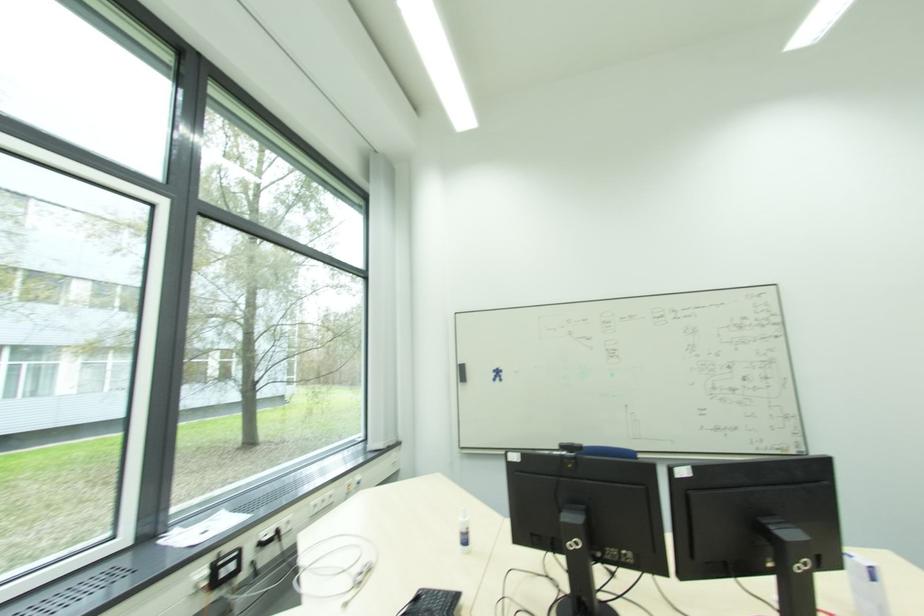
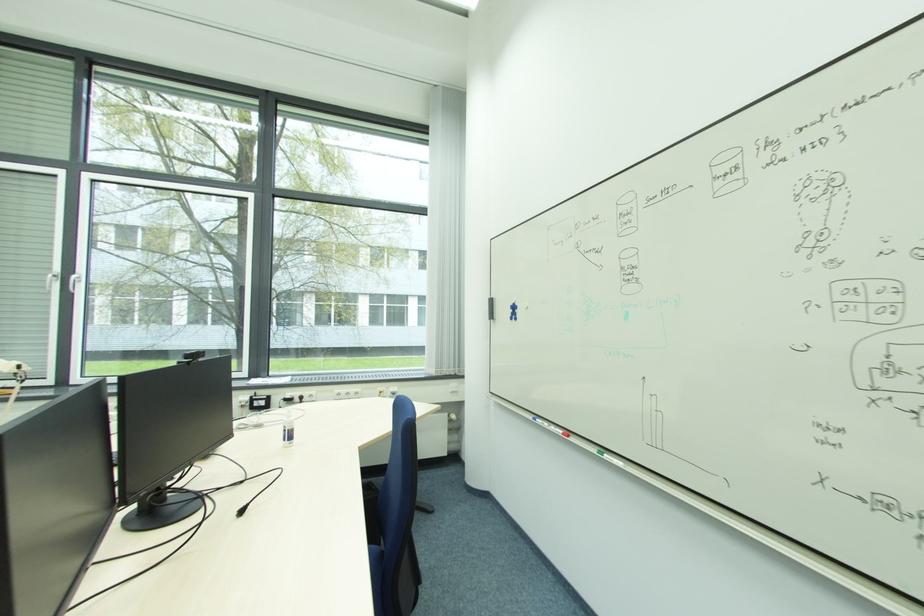
Find the pixel in the second image that matches point 497,377 in the first image.

(515, 313)